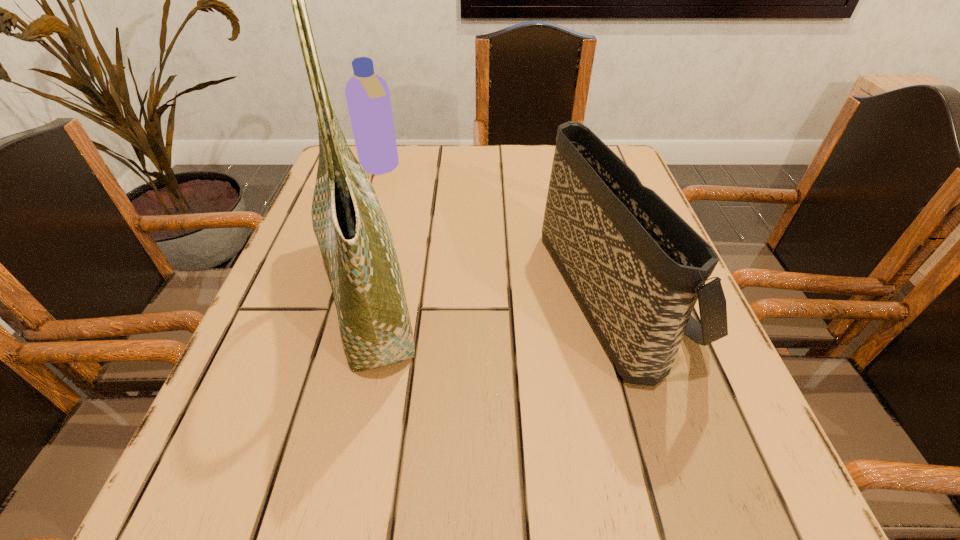
I want to click on the tallest object, so click(354, 238).

Identify the location of the farthest object. The width and height of the screenshot is (960, 540). (367, 94).

This screenshot has width=960, height=540. In order to click on handbag in this screenshot , I will do `click(637, 268)`.

This screenshot has height=540, width=960. In order to click on vacant region located 0.120m on the back of the shopping bag in this screenshot , I will do `click(394, 191)`.

This screenshot has height=540, width=960. I want to click on blank space located on the right of the shampoo, so 437,168.

What are the coordinates of `vacant region located on the back of the handbag` in the screenshot? It's located at (587, 203).

At what (x,y) coordinates should I click in order to perform the action: click on object located at the far edge. Please return your answer as a coordinate pair (x, y). This screenshot has width=960, height=540. Looking at the image, I should click on (367, 94).

You are a GUI agent. You are given a task and a screenshot of the screen. Output one action in this format:
    pyautogui.click(x=<x>, y=<y>)
    Task: Click on the shopping bag situated at the left edge
    
    Given the screenshot: What is the action you would take?
    pyautogui.click(x=354, y=238)

This screenshot has height=540, width=960. I want to click on shampoo that is positioned at the left edge, so 367,94.

Find the location of a particular element. The image size is (960, 540). object situated at the right edge is located at coordinates (637, 268).